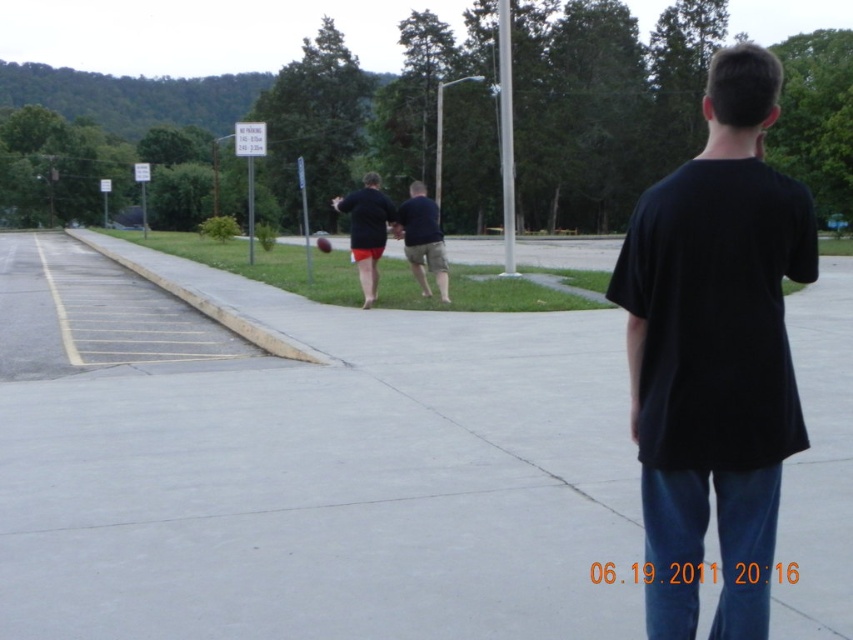
You are a photographer positioned at the edge of the grassy area. You want to capture a photo of both the black cotton shirt at center and the matte black shirt at center in the same frame. Given that your camera has a maximum focus range of 30 feet, will you be able to include both subjects in sharp focus?

The distance between the black cotton shirt at center and the matte black shirt at center is 37.60 feet. Since the camera can only focus up to 30 feet, the subjects are beyond the maximum focus range. Therefore, both subjects cannot be in sharp focus simultaneously.

You are a photographer setting up a camera on a tripod. You want to capture both the matte black shirt at center and the dark blue shirt at center in the same frame. The camera has a focal length of 50mm. What is the minimum distance you should position the camera from the subjects to ensure both are fully in frame?

The minimum distance required would depend on the camera sensor size and field of view at 50mm. However, since the two subjects are 2.76 meters apart, positioning the camera at least 2.76 meters away would ensure both are within the frame, but this is a rough estimate and may vary based on equipment.